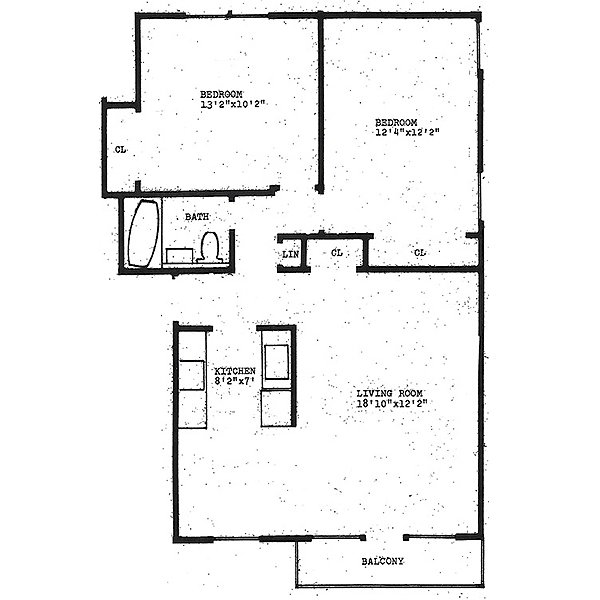
The height and width of the screenshot is (600, 600). What are the coordinates of `kitchen` in the screenshot? It's located at (232, 378).